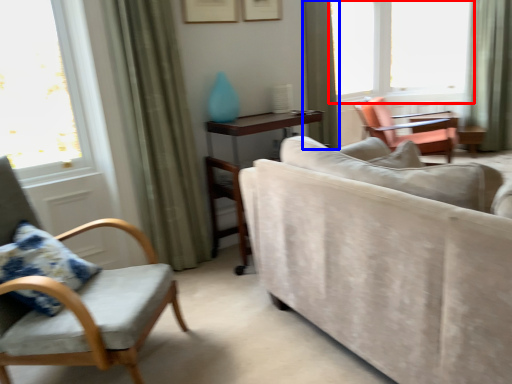
Question: Which object is further to the camera taking this photo, window (highlighted by a red box) or curtain (highlighted by a blue box)?

Choices:
 (A) window
 (B) curtain

Answer: (A)